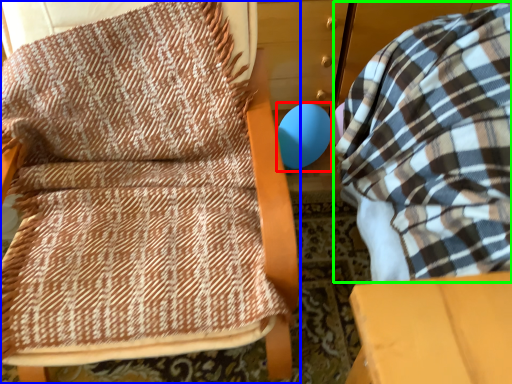
Question: Estimate the real-world distances between objects in this image. Which object is closer to balloon (highlighted by a red box), furniture (highlighted by a blue box) or bean bag chair (highlighted by a green box)?

Choices:
 (A) furniture
 (B) bean bag chair

Answer: (B)